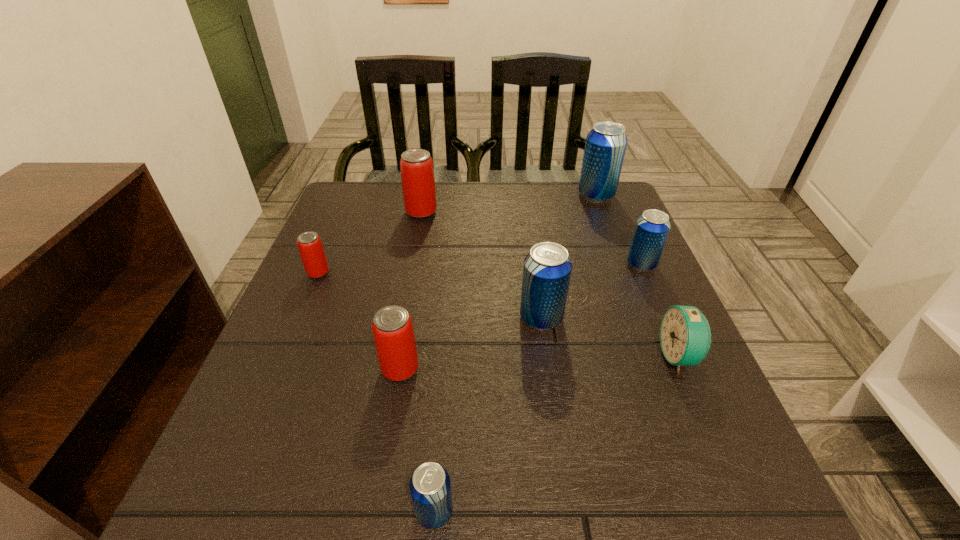
Where is `vacant space that satisfies the following two spatial constraints: 1. on the back side of the tallest beer can; 2. on the left side of the nearest pink beer can`? The width and height of the screenshot is (960, 540). vacant space that satisfies the following two spatial constraints: 1. on the back side of the tallest beer can; 2. on the left side of the nearest pink beer can is located at coordinates (429, 195).

Identify the location of blank area in the image that satisfies the following two spatial constraints: 1. on the front side of the biggest pink beer can; 2. on the left side of the nearest beer can. This screenshot has height=540, width=960. (367, 511).

Find the location of a particular element. vacant space that satisfies the following two spatial constraints: 1. on the back side of the third beer can from right to left; 2. on the right side of the second farthest blue beer can is located at coordinates (534, 265).

Where is `vacant space that satisfies the following two spatial constraints: 1. on the back side of the leftmost object; 2. on the left side of the third nearest blue beer can`? The height and width of the screenshot is (540, 960). vacant space that satisfies the following two spatial constraints: 1. on the back side of the leftmost object; 2. on the left side of the third nearest blue beer can is located at coordinates (322, 265).

This screenshot has width=960, height=540. I want to click on free point that satisfies the following two spatial constraints: 1. on the back side of the leftmost beer can; 2. on the right side of the second farthest blue beer can, so click(x=322, y=265).